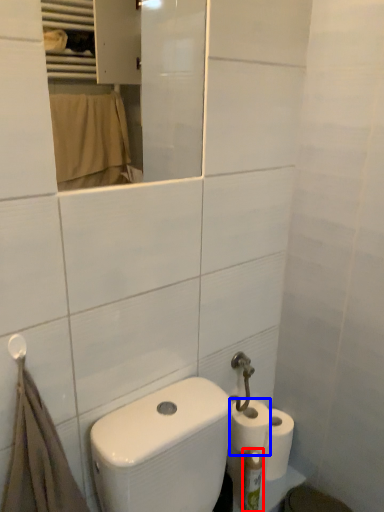
Question: Which point is further to the camera, toiletry (highlighted by a red box) or toilet paper (highlighted by a blue box)?

Choices:
 (A) toiletry
 (B) toilet paper

Answer: (B)